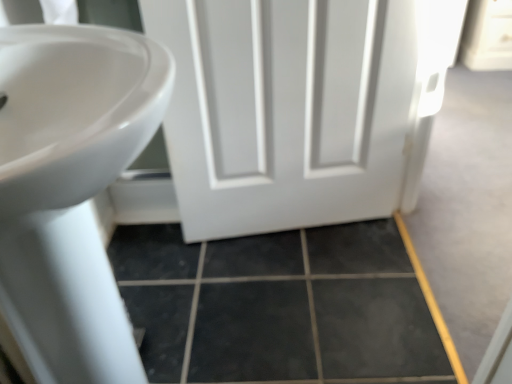
Question: Considering the relative sizes of white glossy sink at left and white matte door at center in the image provided, is white glossy sink at left thinner than white matte door at center?

Choices:
 (A) yes
 (B) no

Answer: (B)

Question: From the image's perspective, is white glossy sink at left beneath white matte door at center?

Choices:
 (A) no
 (B) yes

Answer: (B)

Question: Is white glossy sink at left surrounding white matte door at center?

Choices:
 (A) yes
 (B) no

Answer: (B)

Question: Does white glossy sink at left touch white matte door at center?

Choices:
 (A) no
 (B) yes

Answer: (A)

Question: Can you confirm if white glossy sink at left is wider than white matte door at center?

Choices:
 (A) yes
 (B) no

Answer: (A)

Question: Is point (79, 248) positioned closer to the camera than point (318, 286)?

Choices:
 (A) closer
 (B) farther

Answer: (A)

Question: From a real-world perspective, relative to dark gray tile at lower center, is white glossy sink at left vertically above or below?

Choices:
 (A) above
 (B) below

Answer: (A)

Question: Looking at the image, does white glossy sink at left seem bigger or smaller compared to dark gray tile at lower center?

Choices:
 (A) small
 (B) big

Answer: (B)

Question: In the image, is white glossy sink at left positioned in front of or behind dark gray tile at lower center?

Choices:
 (A) front
 (B) behind

Answer: (A)

Question: In terms of width, does white matte door at center look wider or thinner when compared to dark gray tile at lower center?

Choices:
 (A) thin
 (B) wide

Answer: (A)

Question: Is point (344, 130) closer or farther from the camera than point (198, 283)?

Choices:
 (A) farther
 (B) closer

Answer: (B)

Question: From a real-world perspective, is white matte door at center positioned above or below dark gray tile at lower center?

Choices:
 (A) below
 (B) above

Answer: (B)

Question: In terms of height, does white matte door at center look taller or shorter compared to dark gray tile at lower center?

Choices:
 (A) tall
 (B) short

Answer: (A)

Question: From their relative heights in the image, would you say dark gray tile at lower center is taller or shorter than white glossy sink at left?

Choices:
 (A) tall
 (B) short

Answer: (B)

Question: Is dark gray tile at lower center bigger or smaller than white glossy sink at left?

Choices:
 (A) small
 (B) big

Answer: (A)